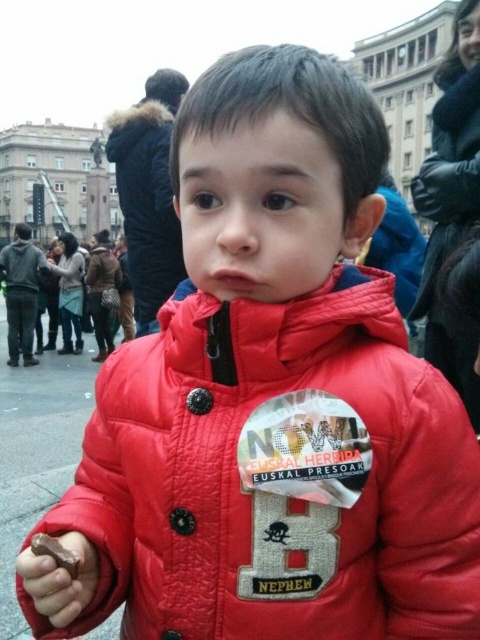
You are a fashion designer who needs to place a new clothing line display in a store. The store has a limited space of 30 meters between two pillars. You have two jackets to display, the black leather jacket at upper right and the matte black jacket at upper center. Can both jackets be placed between the pillars without exceeding the space?

The black leather jacket at upper right and matte black jacket at upper center are 30.50 meters apart from each other. Since the space between the pillars is only 30 meters, the jackets cannot be placed without exceeding the available space.

You are a fashion designer observing a group of people in a square. You notice two jackets in the crowd. The first is the black leather jacket at upper right and the second is the matte black jacket at upper center. Which jacket is closer to you?

The black leather jacket at upper right is closer to you because it is in front of the matte black jacket at upper center.

You are a photographer trying to capture a clear shot of the matte black jacket at upper center and the chocolate matte at lower left. Which object should you focus on first to ensure both are in focus?

You should focus on the matte black jacket at upper center first because it is closer to you than the chocolate matte at lower left, so adjusting focus from near to far will help both be in focus.